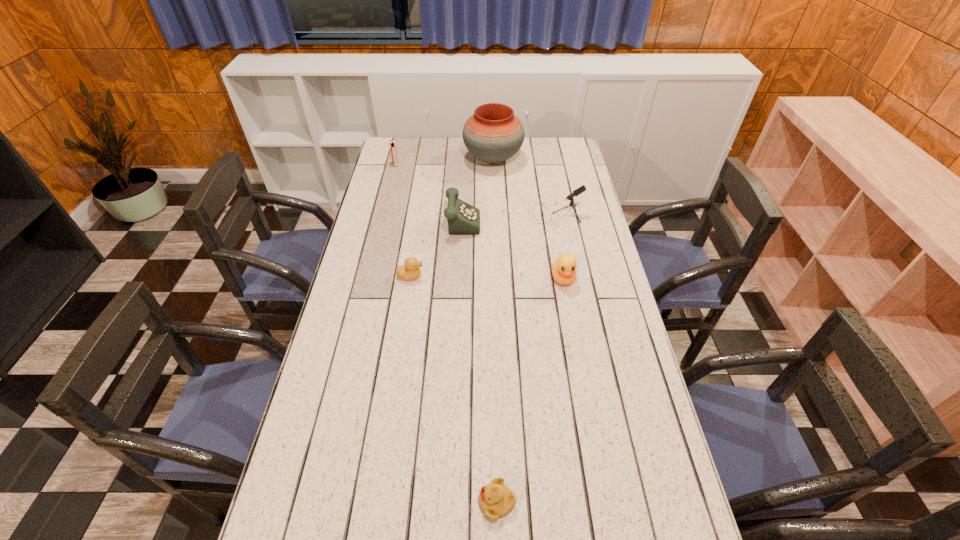
I want to click on pottery, so click(x=493, y=134).

The image size is (960, 540). In order to click on microphone in this screenshot , I will do `click(581, 189)`.

Find the location of a particular element. The image size is (960, 540). telephone is located at coordinates (463, 219).

I want to click on the leftmost object, so click(x=392, y=144).

Where is `the rightmost duckling`? This screenshot has width=960, height=540. the rightmost duckling is located at coordinates coord(564,267).

This screenshot has width=960, height=540. In order to click on the leftmost duckling in this screenshot , I will do `click(410, 270)`.

The height and width of the screenshot is (540, 960). I want to click on the second tallest duckling, so click(x=410, y=270).

At what (x,y) coordinates should I click in order to perform the action: click on the nearest object. Please return your answer as a coordinate pair (x, y). Image resolution: width=960 pixels, height=540 pixels. Looking at the image, I should click on (495, 499).

At what (x,y) coordinates should I click in order to perform the action: click on the shortest duckling. Please return your answer as a coordinate pair (x, y). Looking at the image, I should click on (495, 499).

At what (x,y) coordinates should I click in order to perform the action: click on blank space located 0.060m on the right of the tallest object. Please return your answer as a coordinate pair (x, y). Looking at the image, I should click on (536, 159).